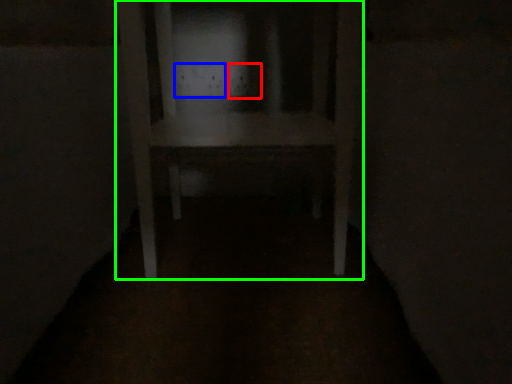
Question: Which is farther away from electric outlet (highlighted by a red box)? electric outlet (highlighted by a blue box) or furniture (highlighted by a green box)?

Choices:
 (A) electric outlet
 (B) furniture

Answer: (B)